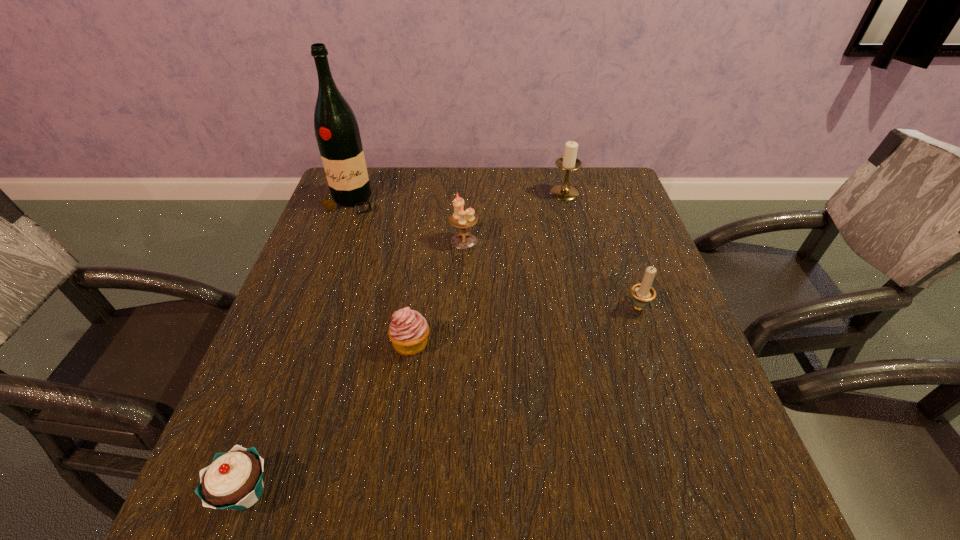
Find the location of a particular element. the tallest object is located at coordinates (337, 133).

Find the location of a particular element. the second candle_holder from right to left is located at coordinates (568, 162).

Locate an element on the screen. This screenshot has width=960, height=540. the farthest candle_holder is located at coordinates (568, 162).

Identify the location of the leftmost candle_holder. Image resolution: width=960 pixels, height=540 pixels. (460, 218).

Identify the location of the second farthest candle_holder. The image size is (960, 540). (460, 218).

Find the location of a particular element. The image size is (960, 540). the rightmost candle_holder is located at coordinates (642, 292).

Locate an element on the screen. This screenshot has height=540, width=960. the fourth tallest object is located at coordinates (642, 292).

Find the location of a particular element. the farther cupcake is located at coordinates (408, 331).

Locate an element on the screen. The image size is (960, 540). the right cupcake is located at coordinates (408, 331).

Image resolution: width=960 pixels, height=540 pixels. I want to click on the nearest object, so click(233, 481).